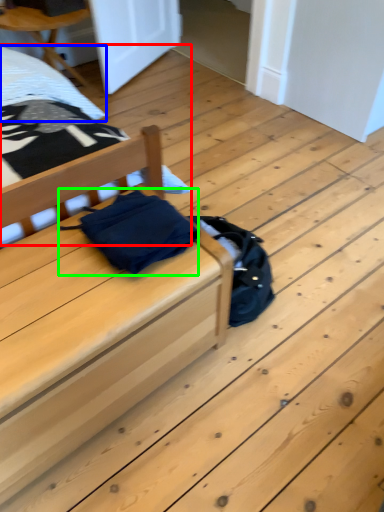
Question: Considering the real-world distances, which object is closest to bed (highlighted by a red box)? sheet (highlighted by a blue box) or material (highlighted by a green box).

Choices:
 (A) sheet
 (B) material

Answer: (A)